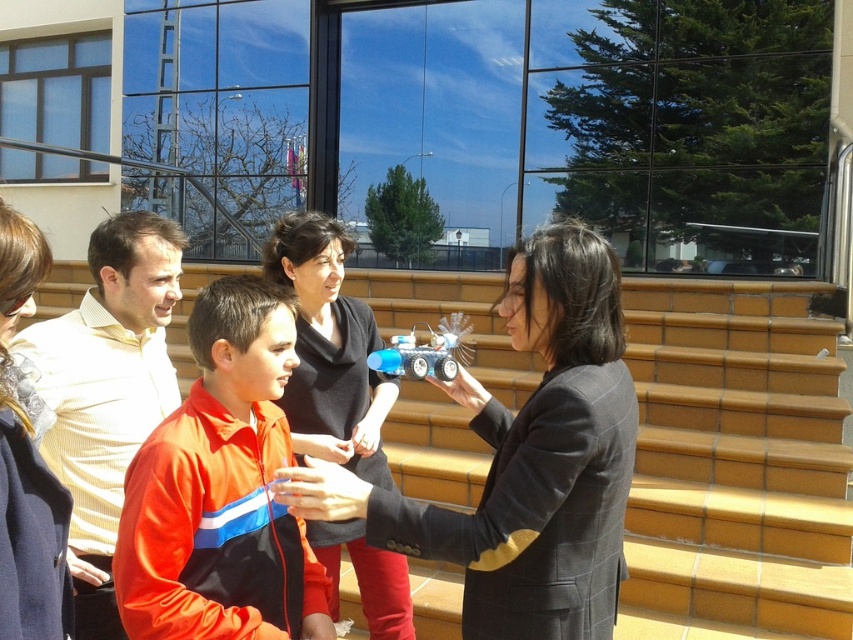
Who is lower down, matte black jacket at center or orange fabric jacket at center?

Positioned lower is orange fabric jacket at center.

Is point (492, 522) farther from camera compared to point (141, 589)?

Yes, point (492, 522) is behind point (141, 589).

Locate an element on the screen. Image resolution: width=853 pixels, height=640 pixels. matte black jacket at center is located at coordinates [x=526, y=460].

Who is positioned more to the left, yellow striped shirt at left or black matte jacket at center?

Positioned to the left is yellow striped shirt at left.

Does yellow striped shirt at left have a lesser width compared to black matte jacket at center?

Yes.

Measure the distance between yellow striped shirt at left and camera.

5.29 feet

Where is `yellow striped shirt at left`? yellow striped shirt at left is located at coordinates (107, 392).

Can you confirm if matte black jacket at center is positioned below orange fleece jacket at lower left?

Yes.

Can you confirm if matte black jacket at center is positioned above orange fleece jacket at lower left?

Actually, matte black jacket at center is below orange fleece jacket at lower left.

Who is more forward, (486, 401) or (33, 552)?

Point (33, 552)

At what (x,y) coordinates should I click in order to perform the action: click on matte black jacket at center. Please return your answer as a coordinate pair (x, y). The width and height of the screenshot is (853, 640). Looking at the image, I should click on (526, 460).